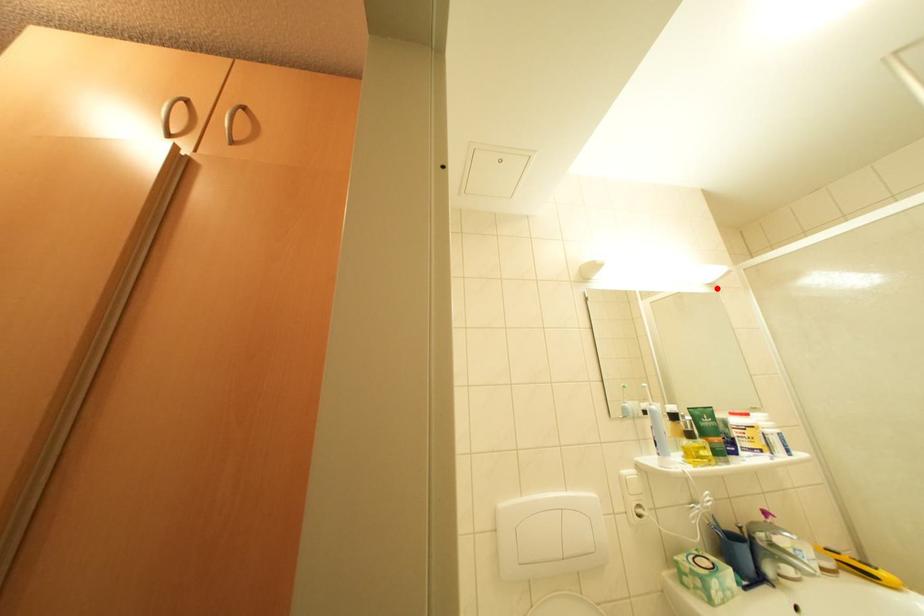
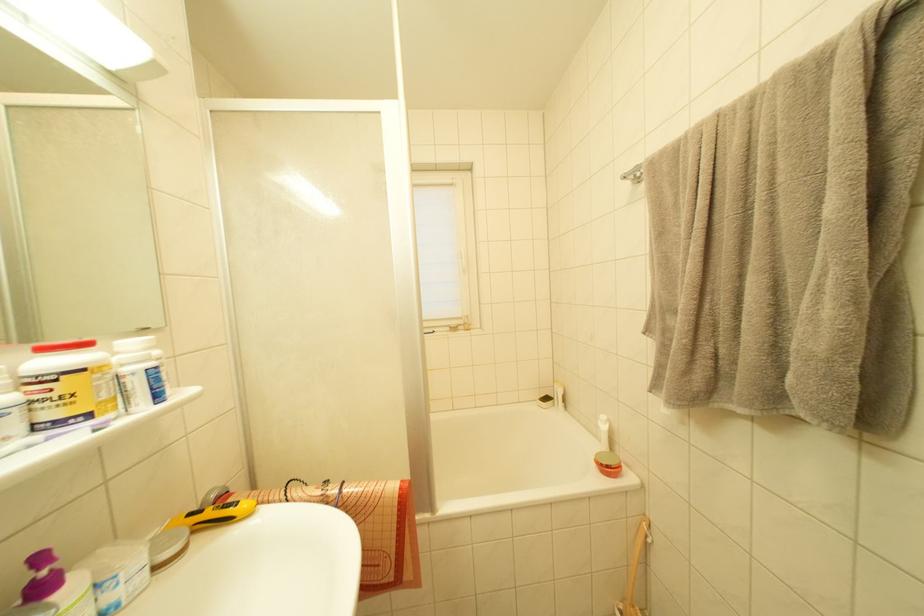
Find the pixel in the second image that matches the highlighted location in the first image.

(127, 84)